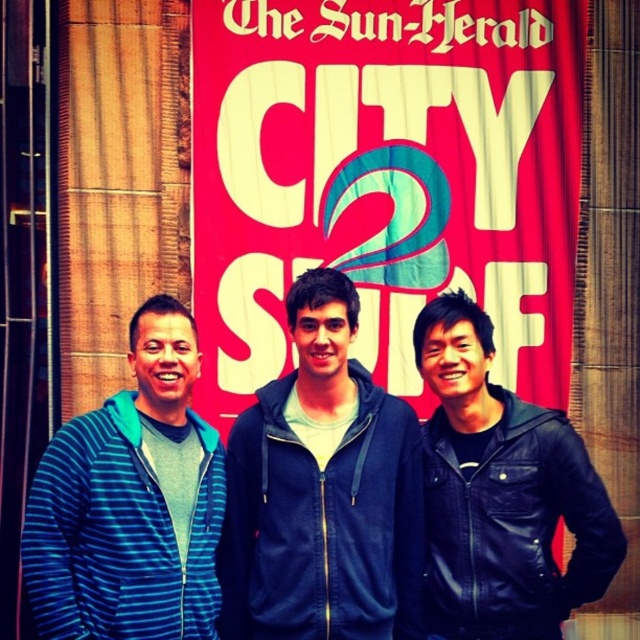
Question: Which point is farther to the camera?

Choices:
 (A) (320, 625)
 (B) (476, 573)

Answer: (B)

Question: Is dark blue hoodie at center in front of blue striped hoodie at left?

Choices:
 (A) no
 (B) yes

Answer: (A)

Question: Which of the following is the closest to the observer?

Choices:
 (A) dark blue hoodie at center
 (B) blue striped hoodie at left

Answer: (B)

Question: Which point is farther from the camera taking this photo?

Choices:
 (A) (476, 360)
 (B) (352, 630)

Answer: (A)

Question: Is dark blue hoodie at center to the right of blue striped hoodie at left from the viewer's perspective?

Choices:
 (A) yes
 (B) no

Answer: (A)

Question: Does dark blue hoodie at center have a larger size compared to blue striped hoodie at left?

Choices:
 (A) yes
 (B) no

Answer: (B)